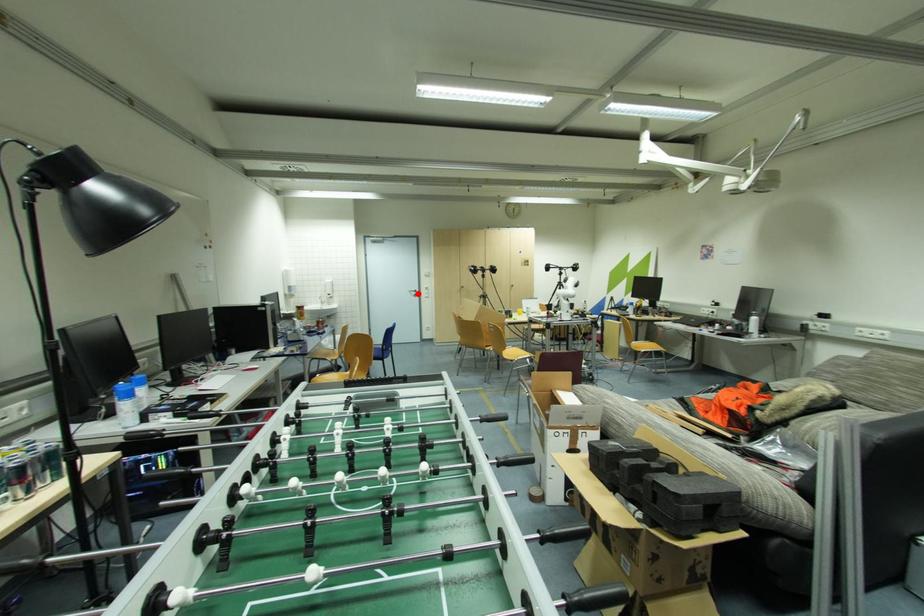
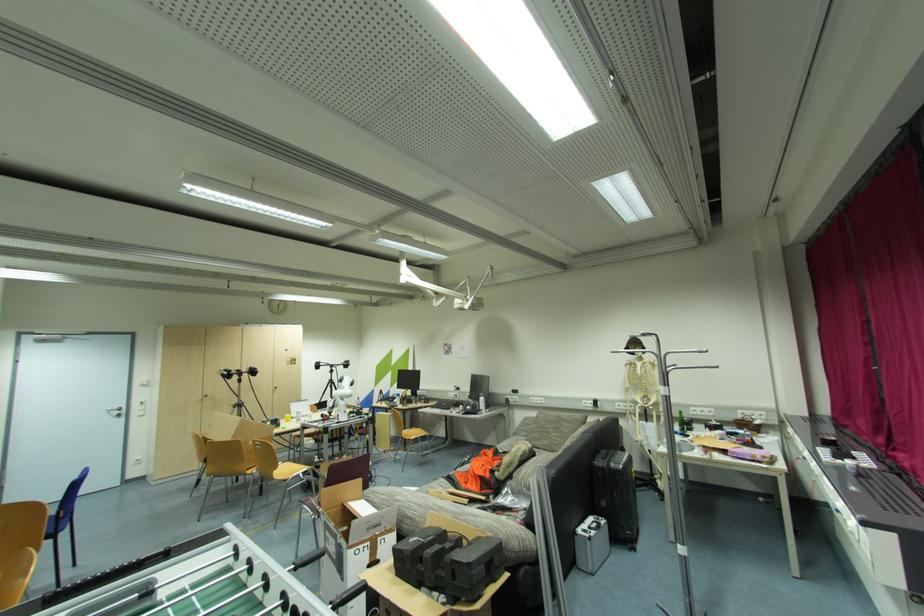
The point at the highlighted location is marked in the first image. Where is the corresponding point in the second image?

(122, 413)